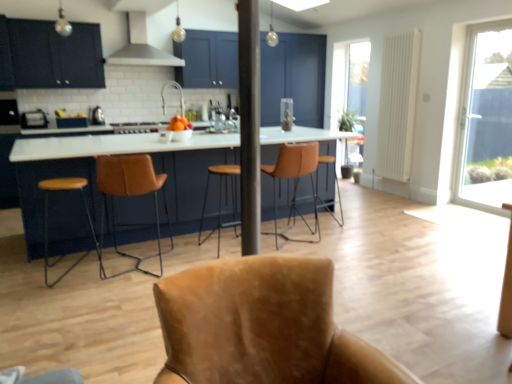
Question: Should I look upward or downward to see leather bar stool at center, placed as the first chair when sorted from back to front?

Choices:
 (A) up
 (B) down

Answer: (A)

Question: From the image's perspective, would you say matte black cabinets at upper left is positioned over brown leather bar stool at center, the first bar stool viewed from the back?

Choices:
 (A) no
 (B) yes

Answer: (B)

Question: Is matte black cabinets at upper left to the left of brown leather bar stool at center, the first bar stool viewed from the back, from the viewer's perspective?

Choices:
 (A) no
 (B) yes

Answer: (B)

Question: From the image's perspective, does matte black cabinets at upper left appear lower than brown leather bar stool at center, marked as the second bar stool in a left-to-right arrangement?

Choices:
 (A) yes
 (B) no

Answer: (B)

Question: Can you confirm if matte black cabinets at upper left is shorter than brown leather bar stool at center, the first bar stool from the right?

Choices:
 (A) yes
 (B) no

Answer: (B)

Question: From a real-world perspective, is matte black cabinets at upper left beneath brown leather bar stool at center, arranged as the second bar stool when viewed from the front?

Choices:
 (A) yes
 (B) no

Answer: (B)

Question: Considering the relative positions of matte black cabinets at upper left and brown leather bar stool at center, arranged as the second bar stool when viewed from the front, in the image provided, is matte black cabinets at upper left in front of brown leather bar stool at center, arranged as the second bar stool when viewed from the front,?

Choices:
 (A) no
 (B) yes

Answer: (A)

Question: Considering the relative sizes of brown leather bar stool at center, arranged as the second bar stool when viewed from the front, and brown leather stool at left, placed as the second chair when sorted from back to front, in the image provided, is brown leather bar stool at center, arranged as the second bar stool when viewed from the front, wider than brown leather stool at left, placed as the second chair when sorted from back to front,?

Choices:
 (A) no
 (B) yes

Answer: (A)

Question: Is brown leather stool at left, which is counted as the 3th chair, starting from the front, located within brown leather bar stool at center, marked as the second bar stool in a left-to-right arrangement?

Choices:
 (A) yes
 (B) no

Answer: (B)

Question: Is brown leather bar stool at center, the first bar stool from the right, thinner than brown leather stool at left, placed as the second chair when sorted from back to front?

Choices:
 (A) no
 (B) yes

Answer: (B)

Question: Are brown leather bar stool at center, marked as the second bar stool in a left-to-right arrangement, and brown leather stool at left, which is counted as the 3th chair, starting from the front, located far from each other?

Choices:
 (A) yes
 (B) no

Answer: (A)

Question: Could you tell me if brown leather bar stool at center, marked as the second bar stool in a left-to-right arrangement, is turned towards brown leather stool at left, which is counted as the 3th chair, starting from the front?

Choices:
 (A) yes
 (B) no

Answer: (B)

Question: From the image's perspective, is brown leather bar stool at center, arranged as the second bar stool when viewed from the front, above brown leather stool at left, which is counted as the 3th chair, starting from the front?

Choices:
 (A) yes
 (B) no

Answer: (A)

Question: Is matte black toaster at left, the 2th appliance in the right-to-left sequence, taller than brown leather stool at left, placed as the second chair when sorted from back to front?

Choices:
 (A) yes
 (B) no

Answer: (B)